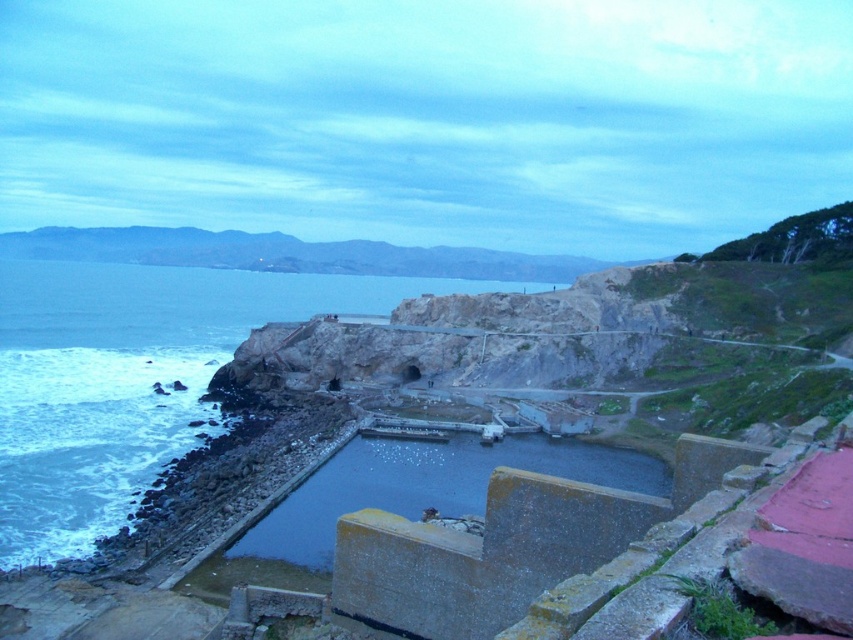
Question: Does clear blue water at center have a lesser width compared to dark gray concrete water at center?

Choices:
 (A) yes
 (B) no

Answer: (B)

Question: Which object is farther from the camera taking this photo?

Choices:
 (A) dark gray concrete water at center
 (B) clear blue water at center

Answer: (B)

Question: Can you confirm if clear blue water at center is positioned to the right of dark gray concrete water at center?

Choices:
 (A) no
 (B) yes

Answer: (A)

Question: Which point is closer to the camera taking this photo?

Choices:
 (A) (111, 525)
 (B) (465, 442)

Answer: (A)

Question: Is clear blue water at center smaller than dark gray concrete water at center?

Choices:
 (A) yes
 (B) no

Answer: (B)